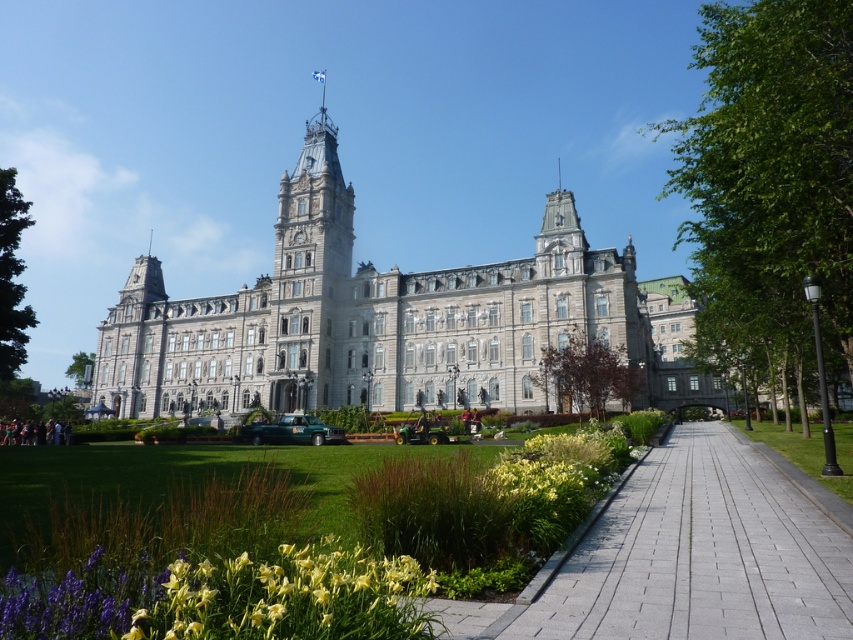
Question: Where is gray stone building at center located in relation to yellow-green foliage at lower center in the image?

Choices:
 (A) right
 (B) left

Answer: (B)

Question: Estimate the real-world distances between objects in this image. Which object is closer to the gray stone tower at center?

Choices:
 (A) gray concrete sidewalk at center
 (B) yellow-green foliage at lower center
 (C) yellow matte flower at lower left

Answer: (B)

Question: Which of the following is the farthest from the observer?

Choices:
 (A) yellow-green foliage at lower center
 (B) gray stone tower at center
 (C) yellow matte flower at lower left

Answer: (B)

Question: Among these points, which one is nearest to the camera?

Choices:
 (A) (538, 352)
 (B) (653, 525)
 (C) (303, 252)

Answer: (B)

Question: Does gray concrete sidewalk at center lie behind yellow matte flower at lower left?

Choices:
 (A) no
 (B) yes

Answer: (B)

Question: In this image, where is yellow-green foliage at lower center located relative to yellow matte flower at lower left?

Choices:
 (A) above
 (B) below

Answer: (A)